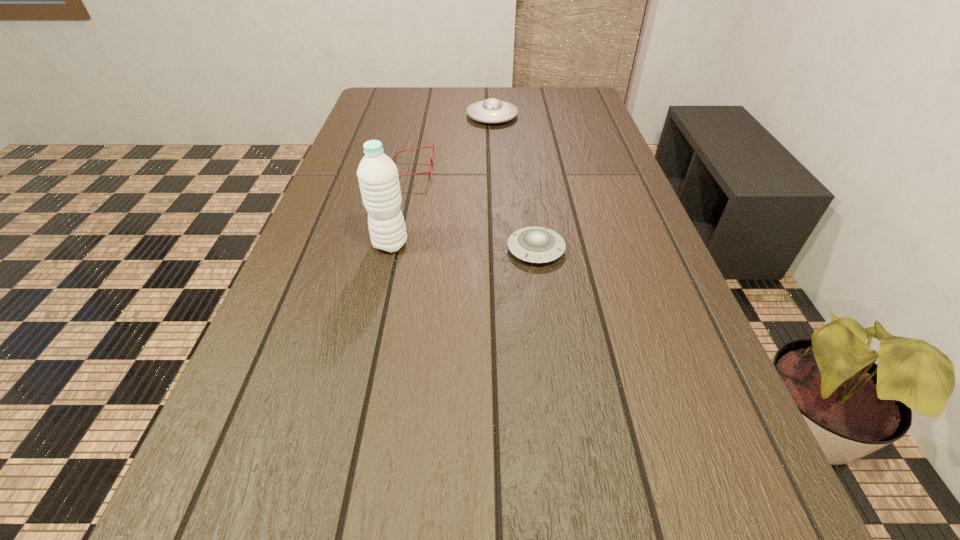
Identify the location of object that is at the far edge. (492, 110).

The height and width of the screenshot is (540, 960). I want to click on water bottle that is at the left edge, so click(378, 178).

You are a GUI agent. You are given a task and a screenshot of the screen. Output one action in this format:
    pyautogui.click(x=<x>, y=<y>)
    Task: Click on the spectacles at the left edge
    
    Given the screenshot: What is the action you would take?
    pyautogui.click(x=432, y=162)

The width and height of the screenshot is (960, 540). Find the location of `vacant area at the far edge`. vacant area at the far edge is located at coordinates (457, 96).

The image size is (960, 540). I want to click on vacant space at the left edge of the desktop, so click(x=334, y=327).

Find the location of a particular element. vacant space at the right edge of the desktop is located at coordinates (683, 291).

Locate an element on the screen. This screenshot has width=960, height=540. free space at the far left corner of the desktop is located at coordinates point(401,88).

Image resolution: width=960 pixels, height=540 pixels. Find the location of `free space between the farther saucer and the tallest object`. free space between the farther saucer and the tallest object is located at coordinates (442, 180).

The image size is (960, 540). I want to click on free spot between the water bottle and the shortest object, so click(x=463, y=247).

What are the coordinates of `vacant space that is in between the farther saucer and the tallest object` in the screenshot? It's located at (442, 180).